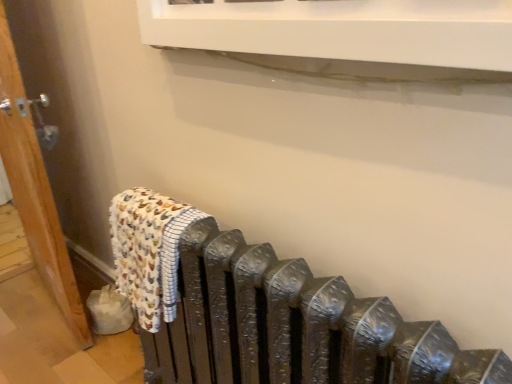
The height and width of the screenshot is (384, 512). What do you see at coordinates (148, 251) in the screenshot?
I see `printed cotton bath towel at left` at bounding box center [148, 251].

Find the location of a particular element. This screenshot has height=384, width=512. printed cotton bath towel at left is located at coordinates (148, 251).

Describe the element at coordinates (35, 190) in the screenshot. Image resolution: width=512 pixels, height=384 pixels. I see `wooden door at left` at that location.

Where is `wooden door at left`? This screenshot has width=512, height=384. wooden door at left is located at coordinates (35, 190).

Locate an element on the screen. printed cotton bath towel at left is located at coordinates (148, 251).

Is wooden door at left to the left or to the right of printed cotton bath towel at left in the image?

In the image, wooden door at left appears on the left side of printed cotton bath towel at left.

Considering the positions of objects wooden door at left and printed cotton bath towel at left in the image provided, who is behind, wooden door at left or printed cotton bath towel at left?

wooden door at left is further from the camera.

Between point (11, 163) and point (177, 227), which one is positioned in front?

The point (177, 227) is in front.

From the image's perspective, is wooden door at left positioned above or below printed cotton bath towel at left?

wooden door at left is above printed cotton bath towel at left.

Looking at this image, from a real-world perspective, is wooden door at left above or below printed cotton bath towel at left?

wooden door at left is above printed cotton bath towel at left.

Considering the relative sizes of wooden door at left and printed cotton bath towel at left in the image provided, is wooden door at left wider than printed cotton bath towel at left?

Indeed, wooden door at left has a greater width compared to printed cotton bath towel at left.

Is wooden door at left shorter than printed cotton bath towel at left?

No.

Based on their sizes in the image, would you say wooden door at left is bigger or smaller than printed cotton bath towel at left?

In the image, wooden door at left appears to be larger than printed cotton bath towel at left.

Is wooden door at left spatially inside printed cotton bath towel at left, or outside of it?

wooden door at left is located beyond the bounds of printed cotton bath towel at left.

Is wooden door at left far from printed cotton bath towel at left?

wooden door at left is near printed cotton bath towel at left, not far away.

Is wooden door at left oriented away from printed cotton bath towel at left?

No, wooden door at left's orientation is not away from printed cotton bath towel at left.

What's the angular difference between wooden door at left and printed cotton bath towel at left's facing directions?

wooden door at left and printed cotton bath towel at left are facing 10.2 degrees away from each other.

Measure the distance from wooden door at left to printed cotton bath towel at left.

wooden door at left and printed cotton bath towel at left are 20.09 inches apart.

You are a GUI agent. You are given a task and a screenshot of the screen. Output one action in this format:
    pyautogui.click(x=<x>, y=<y>)
    Task: Click on the door above the printed cotton bath towel at left (from a real-world perspective)
    This screenshot has height=384, width=512.
    Given the screenshot: What is the action you would take?
    pyautogui.click(x=35, y=190)

In the image, is printed cotton bath towel at left on the left side or the right side of wooden door at left?

Based on their positions, printed cotton bath towel at left is located to the right of wooden door at left.

Is printed cotton bath towel at left further to camera compared to wooden door at left?

No, printed cotton bath towel at left is in front of wooden door at left.

Does point (161, 240) come farther from viewer compared to point (3, 40)?

No.

From the image's perspective, is printed cotton bath towel at left over wooden door at left?

Actually, printed cotton bath towel at left appears below wooden door at left in the image.

From a real-world perspective, is printed cotton bath towel at left above or below wooden door at left?

Clearly, from a real-world perspective, printed cotton bath towel at left is below wooden door at left.

Which of these two, printed cotton bath towel at left or wooden door at left, is thinner?

Thinner between the two is printed cotton bath towel at left.

Can you confirm if printed cotton bath towel at left is taller than wooden door at left?

In fact, printed cotton bath towel at left may be shorter than wooden door at left.

Who is bigger, printed cotton bath towel at left or wooden door at left?

With larger size is wooden door at left.

Can we say printed cotton bath towel at left lies outside wooden door at left?

Yes.

In the scene shown: Are printed cotton bath towel at left and wooden door at left making contact?

No, printed cotton bath towel at left is not making contact with wooden door at left.

Is printed cotton bath towel at left looking in the opposite direction of wooden door at left?

No, printed cotton bath towel at left is not facing away from wooden door at left.

What's the angular difference between printed cotton bath towel at left and wooden door at left's facing directions?

A: They differ by 10.2 degrees in their facing directions.

Where is `door above the printed cotton bath towel at left (from a real-world perspective)`? door above the printed cotton bath towel at left (from a real-world perspective) is located at coordinates 35,190.

Identify the location of door above the printed cotton bath towel at left (from a real-world perspective). (35, 190).

At what (x,y) coordinates should I click in order to perform the action: click on door behind the printed cotton bath towel at left. Please return your answer as a coordinate pair (x, y). Image resolution: width=512 pixels, height=384 pixels. Looking at the image, I should click on (35, 190).